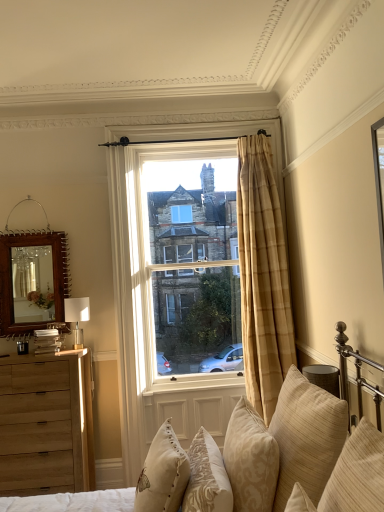
Question: Does natural wood dresser at left lie in front of beige striped pillow at lower right, the 1th pillow positioned from the right?

Choices:
 (A) no
 (B) yes

Answer: (A)

Question: Is natural wood dresser at left positioned beyond the bounds of beige striped pillow at lower right, the 1th pillow positioned from the right?

Choices:
 (A) yes
 (B) no

Answer: (A)

Question: Considering the relative sizes of natural wood dresser at left and beige striped pillow at lower right, the 1th pillow positioned from the right, in the image provided, is natural wood dresser at left shorter than beige striped pillow at lower right, the 1th pillow positioned from the right,?

Choices:
 (A) yes
 (B) no

Answer: (B)

Question: Can you confirm if natural wood dresser at left is thinner than beige striped pillow at lower right, which ranks as the fifth pillow in left-to-right order?

Choices:
 (A) yes
 (B) no

Answer: (B)

Question: Does natural wood dresser at left have a smaller size compared to beige striped pillow at lower right, which ranks as the fifth pillow in left-to-right order?

Choices:
 (A) yes
 (B) no

Answer: (B)

Question: Considering the relative positions of natural wood dresser at left and beige striped pillow at lower right, which ranks as the fifth pillow in left-to-right order, in the image provided, is natural wood dresser at left to the right of beige striped pillow at lower right, which ranks as the fifth pillow in left-to-right order, from the viewer's perspective?

Choices:
 (A) yes
 (B) no

Answer: (B)

Question: From a real-world perspective, is plaid curtain at center, which appears as the 1th window when viewed from the front, over beige striped pillow at lower right, the 1th pillow positioned from the right?

Choices:
 (A) yes
 (B) no

Answer: (A)

Question: Is plaid curtain at center, the second window in the back-to-front sequence, taller than beige striped pillow at lower right, the 1th pillow positioned from the right?

Choices:
 (A) yes
 (B) no

Answer: (A)

Question: Is the position of plaid curtain at center, the second window in the back-to-front sequence, less distant than that of beige striped pillow at lower right, which ranks as the fifth pillow in left-to-right order?

Choices:
 (A) no
 (B) yes

Answer: (A)

Question: Are plaid curtain at center, which appears as the 1th window when viewed from the front, and beige striped pillow at lower right, which ranks as the fifth pillow in left-to-right order, making contact?

Choices:
 (A) yes
 (B) no

Answer: (B)

Question: Is plaid curtain at center, the second window in the back-to-front sequence, far from beige striped pillow at lower right, which ranks as the fifth pillow in left-to-right order?

Choices:
 (A) yes
 (B) no

Answer: (A)

Question: Is beige striped pillow at lower right, which ranks as the fifth pillow in left-to-right order, surrounded by plaid curtain at center, which appears as the 1th window when viewed from the front?

Choices:
 (A) no
 (B) yes

Answer: (A)

Question: Does beige embroidered pillow at lower center, which appears as the 5th pillow when viewed from the right, have a smaller size compared to beige textured pillow at lower right, positioned as the fourth pillow in left-to-right order?

Choices:
 (A) yes
 (B) no

Answer: (A)